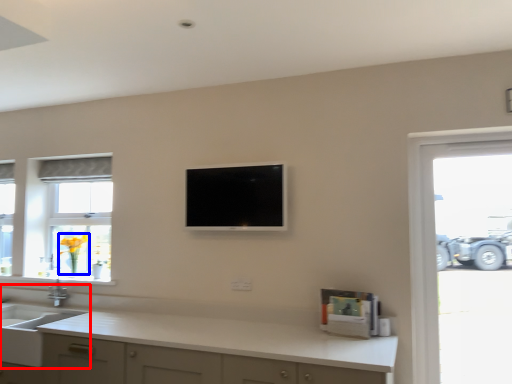
Question: Which of the following is the farthest to the observer, sink (highlighted by a red box) or flower (highlighted by a blue box)?

Choices:
 (A) sink
 (B) flower

Answer: (B)